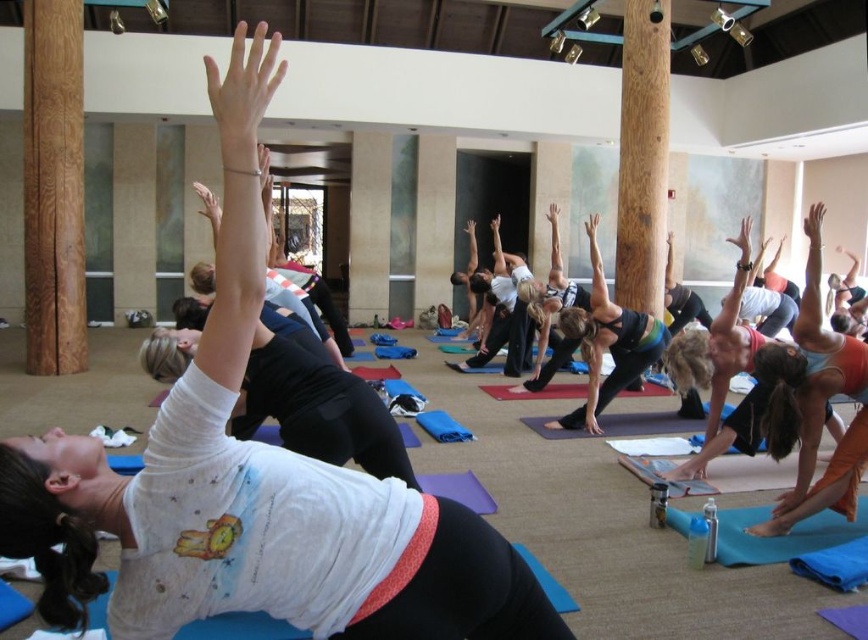
You are a yoga instructor observing the class. You notice the white matte yoga mat at center and the blue fabric yoga mat at lower right. Which mat is positioned higher up in the studio?

The white matte yoga mat at center is positioned higher up in the studio because it is above the blue fabric yoga mat at lower right.

You are a photographer standing at the front of the yoga studio. You want to take a photo that includes both point (162,470) and point (768,547). Which point will appear larger in the photo?

Point (162,470) is closer to the camera than point (768,547), so it will appear larger in the photo.